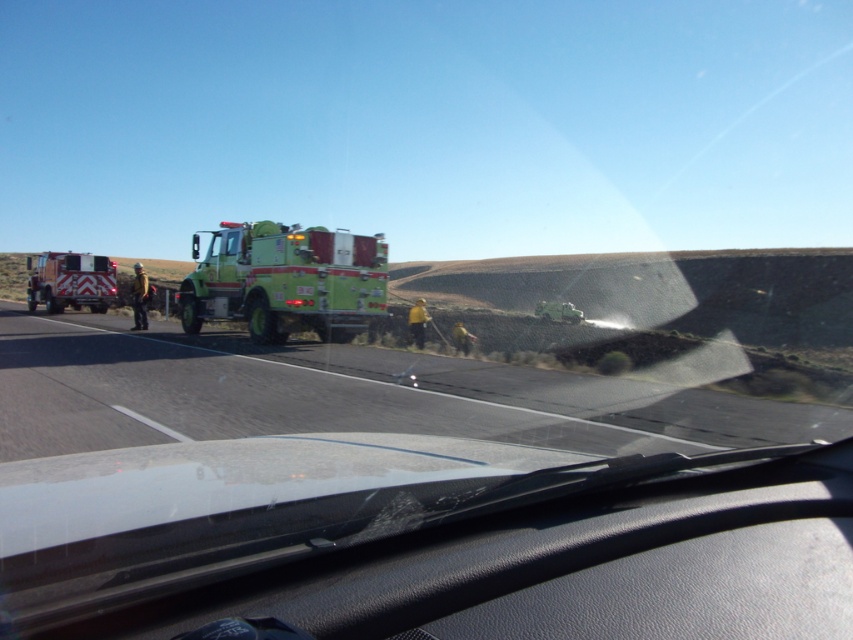
You are navigating a vehicle and need to stay on the black asphalt highway at center. Based on the scene description, where should you position your vehicle relative to the emergency vehicles parked on the left side of the road?

The black asphalt highway at center is located at point (343, 396), so you should position your vehicle on the right side of the road to stay on the highway and avoid the emergency vehicles parked on the left side.